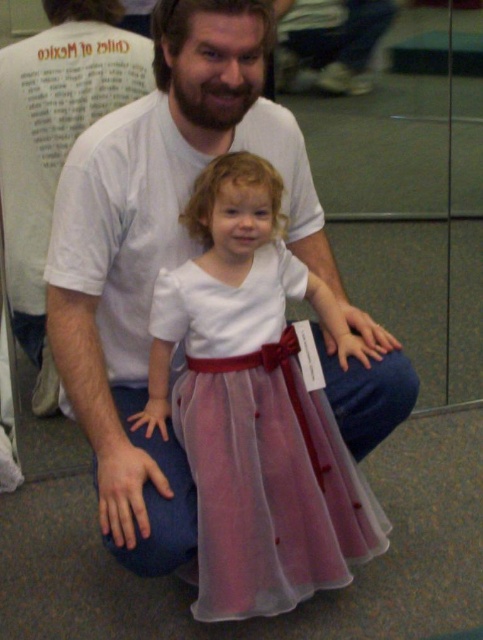
Between point (161, 298) and point (14, 228), which one is positioned in front?

Positioned in front is point (161, 298).

Which is below, pale pink tulle dress at center or white t-shirt at center?

pale pink tulle dress at center

In the scene shown: Measure the distance between pale pink tulle dress at center and camera.

pale pink tulle dress at center and camera are 1.33 meters apart.

At what (x,y) coordinates should I click in order to perform the action: click on pale pink tulle dress at center. Please return your answer as a coordinate pair (x, y). Looking at the image, I should click on (259, 444).

Measure the distance between white cotton shirt at center and white t-shirt at center.

A distance of 30.91 inches exists between white cotton shirt at center and white t-shirt at center.

Identify the location of white cotton shirt at center. The image size is (483, 640). (180, 262).

Does white cotton shirt at center appear on the right side of pale pink tulle dress at center?

No, white cotton shirt at center is not to the right of pale pink tulle dress at center.

Between white cotton shirt at center and pale pink tulle dress at center, which one is positioned lower?

Positioned lower is pale pink tulle dress at center.

The image size is (483, 640). Describe the element at coordinates (180, 262) in the screenshot. I see `white cotton shirt at center` at that location.

Where is `white cotton shirt at center`? This screenshot has height=640, width=483. white cotton shirt at center is located at coordinates (180, 262).